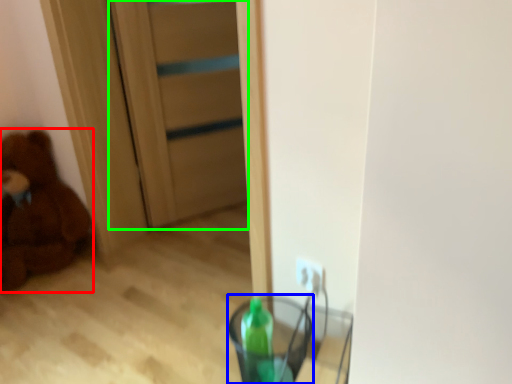
Question: Which object is the farthest from teddy bear (highlighted by a red box)? Choose among these: glass vase (highlighted by a blue box) or door (highlighted by a green box).

Choices:
 (A) glass vase
 (B) door

Answer: (A)